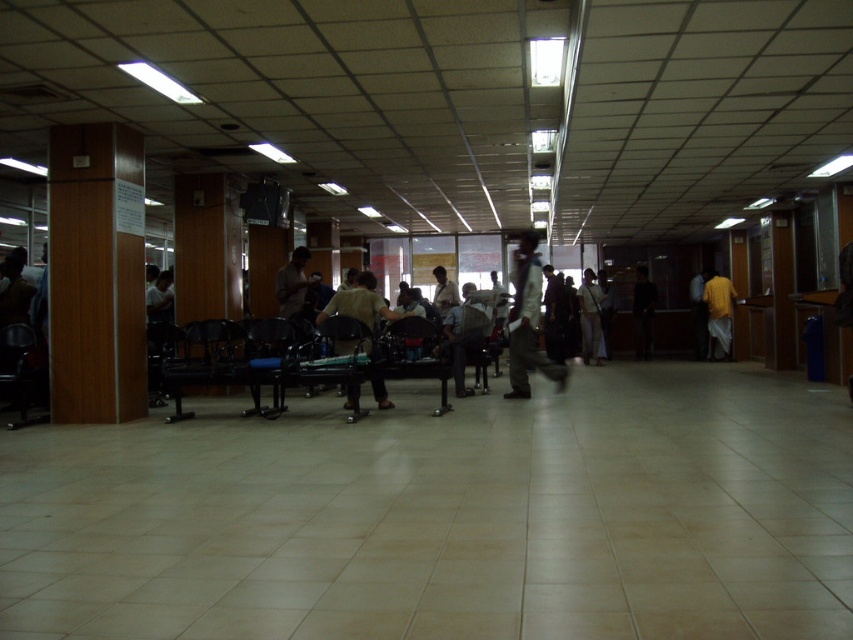
Question: Which of the following is the farthest from the observer?

Choices:
 (A) (723, 300)
 (B) (78, 275)
 (C) (364, 285)
 (D) (556, 358)

Answer: (A)

Question: Which of the following is the farthest from the observer?

Choices:
 (A) coord(299,288)
 (B) coord(93,173)
 (C) coord(254,374)

Answer: (A)

Question: Does metallic blue chair at center have a greater width compared to dark blue fabric pants at center?

Choices:
 (A) no
 (B) yes

Answer: (A)

Question: Can you confirm if yellow matte shirt at right is wider than matte black shirt at center?

Choices:
 (A) no
 (B) yes

Answer: (B)

Question: Which point is farther to the camera?

Choices:
 (A) dark blue fabric pants at center
 (B) metallic blue chair at center
 (C) yellow matte shirt at right
 (D) yellow fabric shirt at center

Answer: (D)

Question: Can you confirm if wooden pillar at left is positioned above light brown leather jacket at center?

Choices:
 (A) yes
 (B) no

Answer: (A)